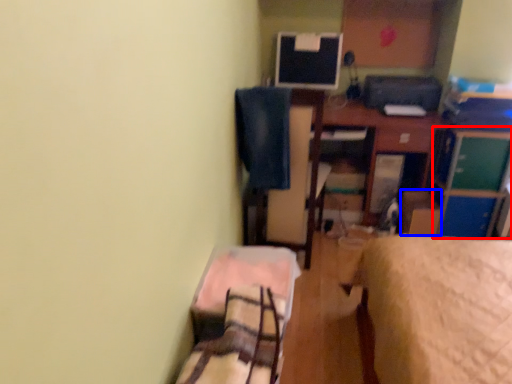
Question: Which object is further to the camera taking this photo, file cabinet (highlighted by a red box) or cardboard box (highlighted by a blue box)?

Choices:
 (A) file cabinet
 (B) cardboard box

Answer: (B)